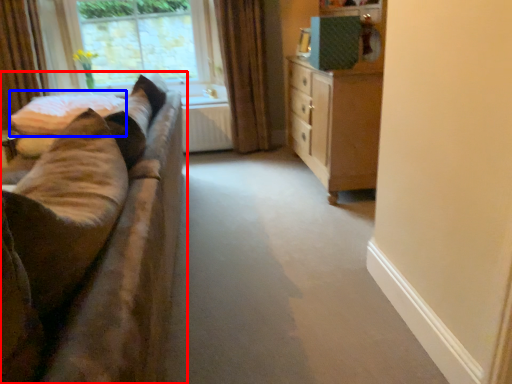
Question: Which object is further to the camera taking this photo, studio couch (highlighted by a red box) or bedding (highlighted by a blue box)?

Choices:
 (A) studio couch
 (B) bedding

Answer: (B)